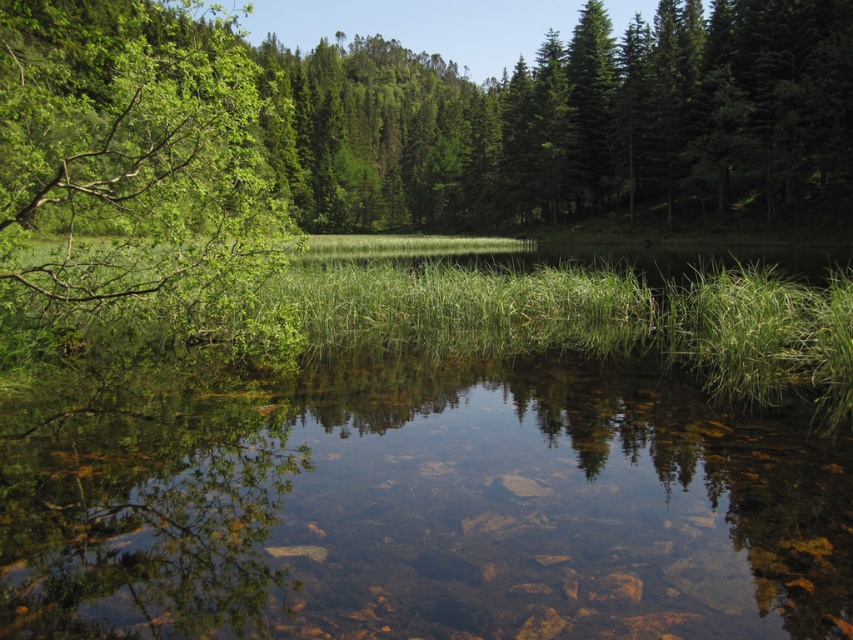
The width and height of the screenshot is (853, 640). Describe the element at coordinates (413, 502) in the screenshot. I see `clear water at center` at that location.

This screenshot has height=640, width=853. Find the location of `clear water at center`. clear water at center is located at coordinates (413, 502).

Find the location of a particular element. The image size is (853, 640). clear water at center is located at coordinates (413, 502).

Can you confirm if green leafy tree at left is wider than green grass at center?

Correct, the width of green leafy tree at left exceeds that of green grass at center.

Which is below, green leafy tree at left or green grass at center?

Positioned lower is green grass at center.

Identify the location of green leafy tree at left. (131, 177).

Does point (618, 577) come closer to viewer compared to point (636, 294)?

Yes.

Does clear water at center have a smaller size compared to green grass at center?

Correct, clear water at center occupies less space than green grass at center.

You are a GUI agent. You are given a task and a screenshot of the screen. Output one action in this format:
    pyautogui.click(x=<x>, y=<y>)
    Task: Click on the clear water at center
    This screenshot has height=640, width=853.
    Given the screenshot: What is the action you would take?
    pyautogui.click(x=413, y=502)